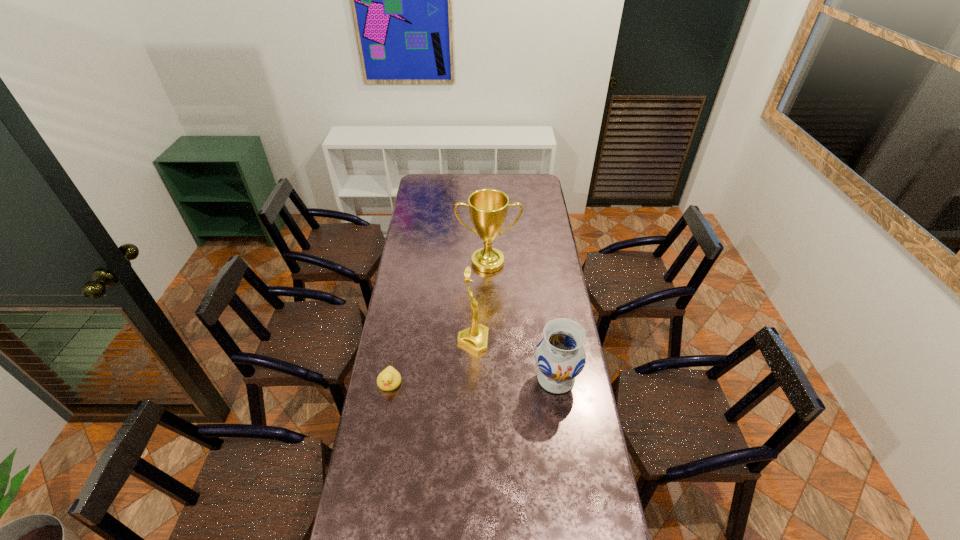
Where is `vacant area that lies between the second farthest object and the farther award`? The width and height of the screenshot is (960, 540). vacant area that lies between the second farthest object and the farther award is located at coordinates (480, 301).

Find the location of a particular element. The width and height of the screenshot is (960, 540). free space between the farthest object and the rightmost object is located at coordinates (521, 320).

Where is `free space between the leftmost object and the farthest object`? The width and height of the screenshot is (960, 540). free space between the leftmost object and the farthest object is located at coordinates (439, 322).

Where is `unoccupied area between the second farthest object and the farthest object`? The image size is (960, 540). unoccupied area between the second farthest object and the farthest object is located at coordinates (480, 301).

Locate an element on the screen. This screenshot has width=960, height=540. free space between the rightmost object and the third nearest object is located at coordinates (515, 360).

Find the location of `free space between the vase and the second farthest object`. free space between the vase and the second farthest object is located at coordinates (515, 360).

Identify the location of object that is the second closest one to the shortest object. (560, 356).

Locate which object ranks third in proximity to the leftmost object. Please provide its 2D coordinates. Your answer should be formatted as a tuple, i.e. [(x, y)], where the tuple contains the x and y coordinates of a point satisfying the conditions above.

[(488, 208)]

The image size is (960, 540). I want to click on free spot that satisfies the following two spatial constraints: 1. by the handles of the third tallest object; 2. on the left side of the farther award, so click(x=490, y=379).

Locate an element on the screen. This screenshot has width=960, height=540. vacant space that satisfies the following two spatial constraints: 1. by the handles of the vase; 2. on the right side of the farthest object is located at coordinates (490, 379).